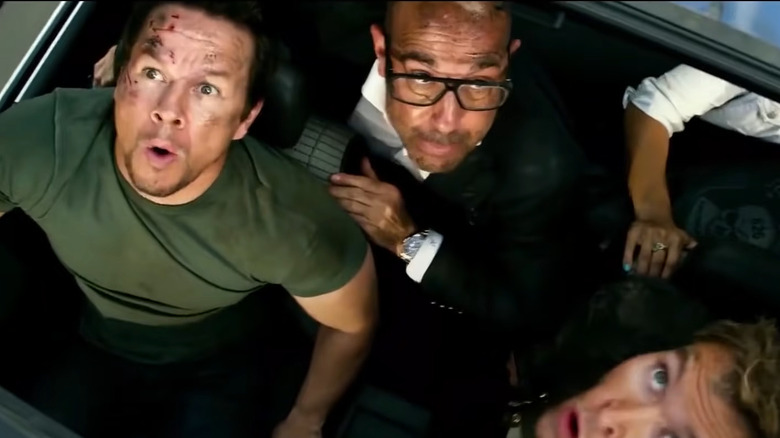
Find the location of `seat`. seat is located at coordinates (312, 137).